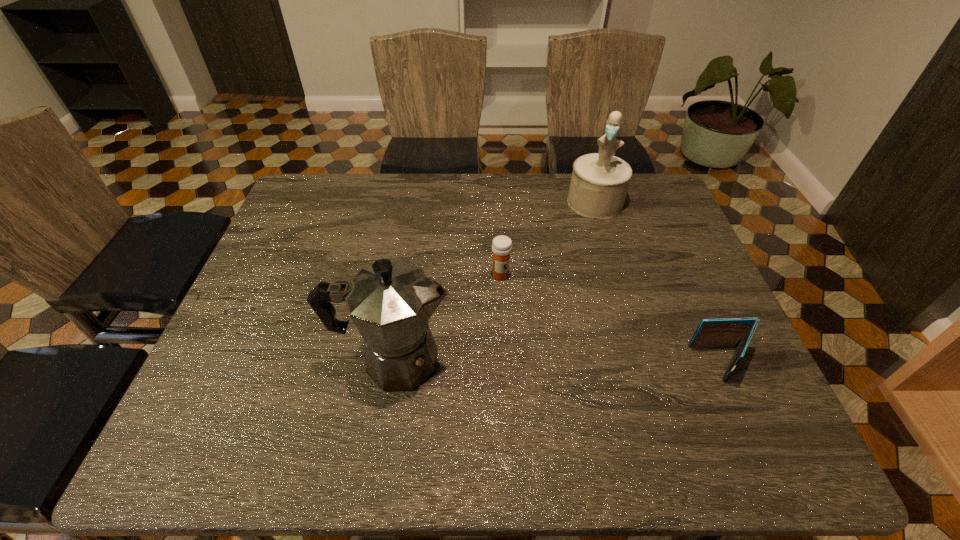
Find the location of `vacant spot on the desktop that is between the coffeepot and the rightmost object and is positioned on the label side of the medicine`. vacant spot on the desktop that is between the coffeepot and the rightmost object and is positioned on the label side of the medicine is located at coordinates (562, 362).

Where is `vacant space on the desktop that is between the leftmost object and the shortest object and is positioned at the beak of the figurine`? vacant space on the desktop that is between the leftmost object and the shortest object and is positioned at the beak of the figurine is located at coordinates (547, 362).